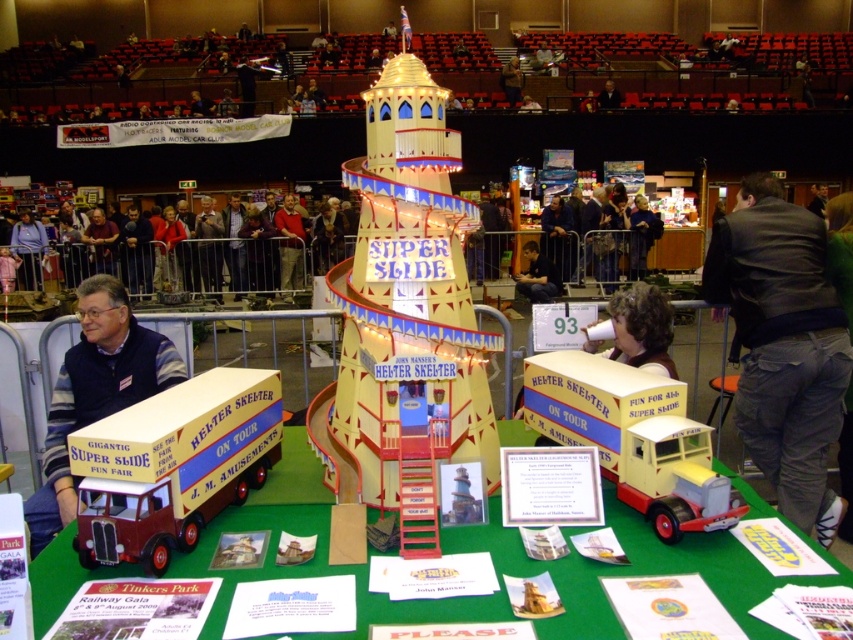
Question: Which point appears farthest from the camera in this image?

Choices:
 (A) (97, 353)
 (B) (480, 509)
 (C) (250, 228)
 (D) (618, 474)

Answer: (C)

Question: Considering the real-world distances, which object is closest to the matte black jacket at center?

Choices:
 (A) gold metallic helter skelter at center
 (B) matte black shirt at center
 (C) dark gray jacket at center

Answer: (B)

Question: Is maroon plastic truck at lower left closer to the viewer compared to yellow matte truck at center?

Choices:
 (A) yes
 (B) no

Answer: (A)

Question: Can you confirm if maroon plastic truck at lower left is positioned below dark gray suit at upper center?

Choices:
 (A) no
 (B) yes

Answer: (B)

Question: Can you confirm if matte white cup at center is thinner than matte yellow helter skelter at center?

Choices:
 (A) no
 (B) yes

Answer: (A)

Question: Which point is farther to the camera?

Choices:
 (A) maroon plastic truck at lower left
 (B) dark gray jacket at center
 (C) yellow matte truck at center
 (D) matte black jacket at center

Answer: (B)